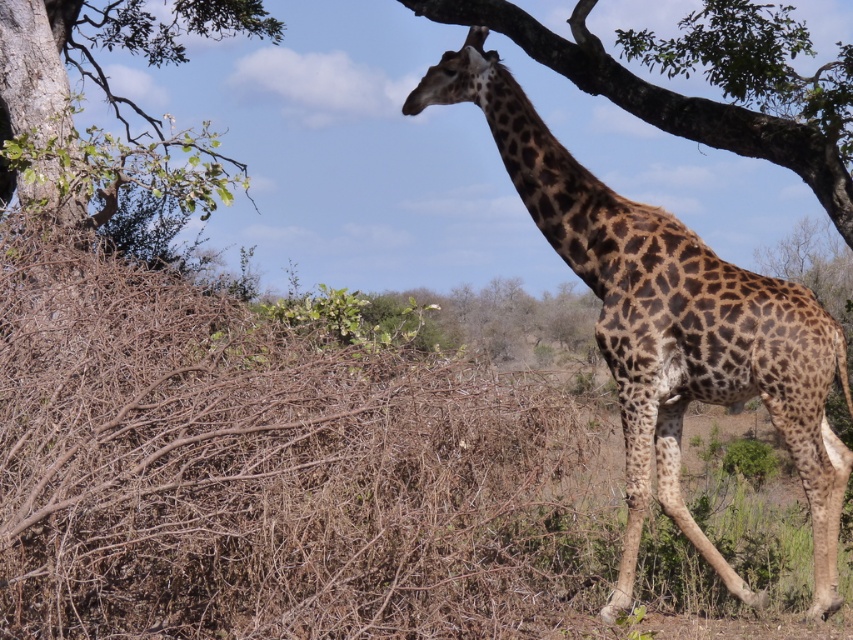
You are a wildlife photographer aiming to capture the giraffe and the tree in the same frame. Given the spotted fur giraffe at center and the green leafy tree at upper left, which one appears narrower in the image?

The spotted fur giraffe at center appears narrower than the green leafy tree at upper left because its width is less than the tree.

Based on the photo, you are a wildlife photographer observing the scene. You want to capture a photo where the spotted fur giraffe at center and the green leafy tree at upper left are both visible. Based on their sizes, which object would appear closer to the camera in the photo?

The spotted fur giraffe at center appears closer to the camera because it is smaller than the green leafy tree at upper left. In photography, smaller objects can be positioned closer to the camera while still appearing smaller if they are farther away, but given the description, the giraffe being smaller likely indicates it is closer, making the tree appear farther back.